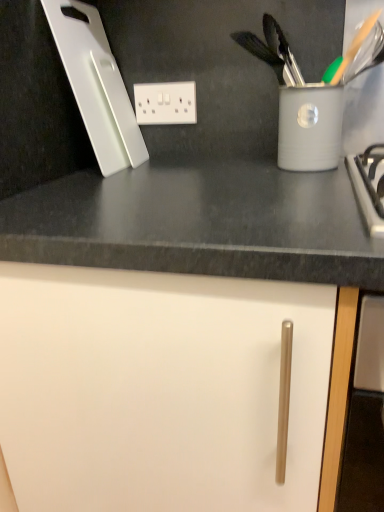
What do you see at coordinates (96, 86) in the screenshot? I see `white plastic cutting board at upper left` at bounding box center [96, 86].

I want to click on white plastic electric outlet at upper center, so click(165, 103).

Where is `white plastic cutting board at upper left`? This screenshot has height=512, width=384. white plastic cutting board at upper left is located at coordinates (96, 86).

Looking at this image, from the image's perspective, is white matte cabinet door at center positioned above or below white plastic electric outlet at upper center?

Based on their image positions, white matte cabinet door at center is located beneath white plastic electric outlet at upper center.

Considering the positions of point (13, 344) and point (185, 91), is point (13, 344) closer or farther from the camera than point (185, 91)?

Point (13, 344) appears to be closer to the viewer than point (185, 91).

Locate an element on the screen. The image size is (384, 512). electric outlet behind the white matte cabinet door at center is located at coordinates (165, 103).

Does white matte cabinet door at center have a lesser width compared to white plastic electric outlet at upper center?

Incorrect, the width of white matte cabinet door at center is not less than that of white plastic electric outlet at upper center.

From a real-world perspective, is white matte cabinet door at center on top of white plastic cutting board at upper left?

No.

From the image's perspective, between white matte cabinet door at center and white plastic cutting board at upper left, which one is located above?

white plastic cutting board at upper left appears higher in the image.

Is white matte cabinet door at center positioned far away from white plastic cutting board at upper left?

They are positioned close to each other.

Locate an element on the screen. This screenshot has width=384, height=512. kitchen appliance behind the white matte cabinet door at center is located at coordinates (96, 86).

Can you tell me how much white plastic electric outlet at upper center and white plastic cutting board at upper left differ in facing direction?

The facing directions of white plastic electric outlet at upper center and white plastic cutting board at upper left are 94.3 degrees apart.

In terms of size, does white plastic electric outlet at upper center appear bigger or smaller than white plastic cutting board at upper left?

Considering their sizes, white plastic electric outlet at upper center takes up less space than white plastic cutting board at upper left.

Between white plastic electric outlet at upper center and white plastic cutting board at upper left, which one has more height?

white plastic cutting board at upper left is taller.

Looking at their sizes, would you say white plastic electric outlet at upper center is wider or thinner than white plastic cutting board at upper left?

In the image, white plastic electric outlet at upper center appears to be more narrow than white plastic cutting board at upper left.

Considering the positions of point (107, 166) and point (166, 116), is point (107, 166) closer or farther from the camera than point (166, 116)?

Point (107, 166) is positioned closer to the camera compared to point (166, 116).

From a real-world perspective, does white plastic cutting board at upper left stand above white plastic electric outlet at upper center?

Yes.

Visually, is white plastic cutting board at upper left positioned to the left or to the right of white plastic electric outlet at upper center?

Clearly, white plastic cutting board at upper left is on the left of white plastic electric outlet at upper center in the image.

How different are the orientations of white plastic cutting board at upper left and white plastic electric outlet at upper center in degrees?

There is a 94.3-degree angle between the facing directions of white plastic cutting board at upper left and white plastic electric outlet at upper center.

Based on the photo, considering the relative sizes of white plastic cutting board at upper left and white matte cabinet door at center in the image provided, is white plastic cutting board at upper left wider than white matte cabinet door at center?

No, white plastic cutting board at upper left is not wider than white matte cabinet door at center.

Does point (73, 64) appear closer or farther from the camera than point (57, 279)?

Point (73, 64) is positioned farther from the camera compared to point (57, 279).

Who is shorter, white plastic cutting board at upper left or white matte cabinet door at center?

Standing shorter between the two is white plastic cutting board at upper left.

Is white plastic cutting board at upper left inside or outside of white matte cabinet door at center?

white plastic cutting board at upper left lies outside white matte cabinet door at center.

Is white plastic electric outlet at upper center placed right next to white matte cabinet door at center?

No, white plastic electric outlet at upper center is not in contact with white matte cabinet door at center.

Considering the points (187, 96) and (11, 420), which point is behind, point (187, 96) or point (11, 420)?

Point (187, 96)

How different are the orientations of white plastic electric outlet at upper center and white matte cabinet door at center in degrees?

There is a 0.5-degree angle between the facing directions of white plastic electric outlet at upper center and white matte cabinet door at center.

Is white plastic electric outlet at upper center positioned beyond the bounds of white matte cabinet door at center?

white plastic electric outlet at upper center is positioned outside white matte cabinet door at center.

Identify the location of electric outlet behind the white matte cabinet door at center. This screenshot has width=384, height=512. (165, 103).

Image resolution: width=384 pixels, height=512 pixels. Find the location of `cabinetry below the white plastic cutting board at upper left (from the image's perspective)`. cabinetry below the white plastic cutting board at upper left (from the image's perspective) is located at coordinates (168, 390).

Considering their positions, is white plastic cutting board at upper left positioned closer to white plastic electric outlet at upper center than white matte cabinet door at center?

Among the two, white plastic cutting board at upper left is located nearer to white plastic electric outlet at upper center.

Based on their spatial positions, is white matte cabinet door at center or white plastic electric outlet at upper center further from white plastic cutting board at upper left?

white matte cabinet door at center is positioned further to the anchor white plastic cutting board at upper left.

Which object lies further to the anchor point white matte cabinet door at center, white plastic cutting board at upper left or white plastic electric outlet at upper center?

Among the two, white plastic electric outlet at upper center is located further to white matte cabinet door at center.

From the image, which object appears to be farther from white matte cabinet door at center, white plastic electric outlet at upper center or white plastic cutting board at upper left?

Based on the image, white plastic electric outlet at upper center appears to be further to white matte cabinet door at center.

Based on their spatial positions, is white plastic electric outlet at upper center or white matte cabinet door at center closer to white plastic cutting board at upper left?

white plastic electric outlet at upper center lies closer to white plastic cutting board at upper left than the other object.

When comparing their distances from white plastic electric outlet at upper center, does white matte cabinet door at center or white plastic cutting board at upper left seem closer?

The object closer to white plastic electric outlet at upper center is white plastic cutting board at upper left.

The height and width of the screenshot is (512, 384). What are the coordinates of `electric outlet that lies between white plastic cutting board at upper left and white matte cabinet door at center from top to bottom` in the screenshot? It's located at (165, 103).